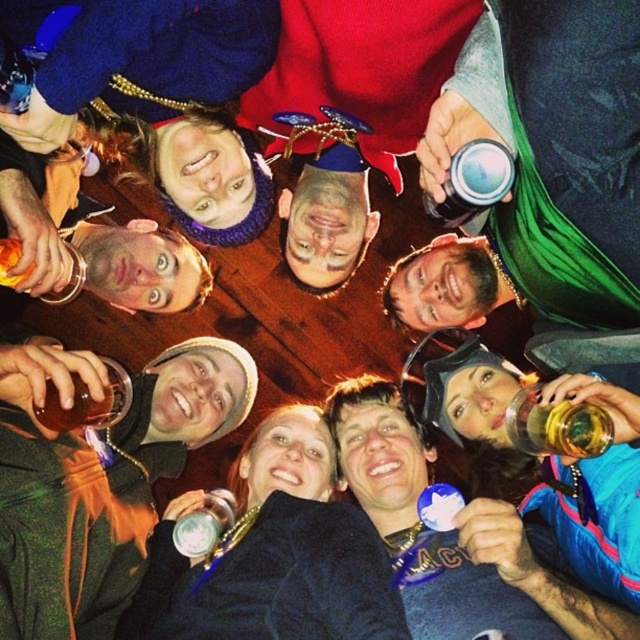
Question: Which of the following is the farthest from the observer?

Choices:
 (A) (460, 195)
 (B) (605, 438)
 (C) (96, 605)
 (D) (557, 426)

Answer: (C)

Question: Does green fabric hat at upper center come in front of translucent plastic cup at upper center?

Choices:
 (A) no
 (B) yes

Answer: (A)

Question: Which point is closer to the camera?

Choices:
 (A) matte black jacket at lower right
 (B) brown glass bottle at center
 (C) translucent plastic cup at upper center
 (D) translucent plastic cup at lower right

Answer: (C)

Question: Which point is closer to the camera?

Choices:
 (A) (116, 413)
 (B) (205, 524)
 (C) (589, 524)

Answer: (C)

Question: Does green fabric hat at upper center appear under translucent plastic cup at lower right?

Choices:
 (A) yes
 (B) no

Answer: (A)

Question: Is green fabric hat at upper center below brown glass bottle at center?

Choices:
 (A) yes
 (B) no

Answer: (A)